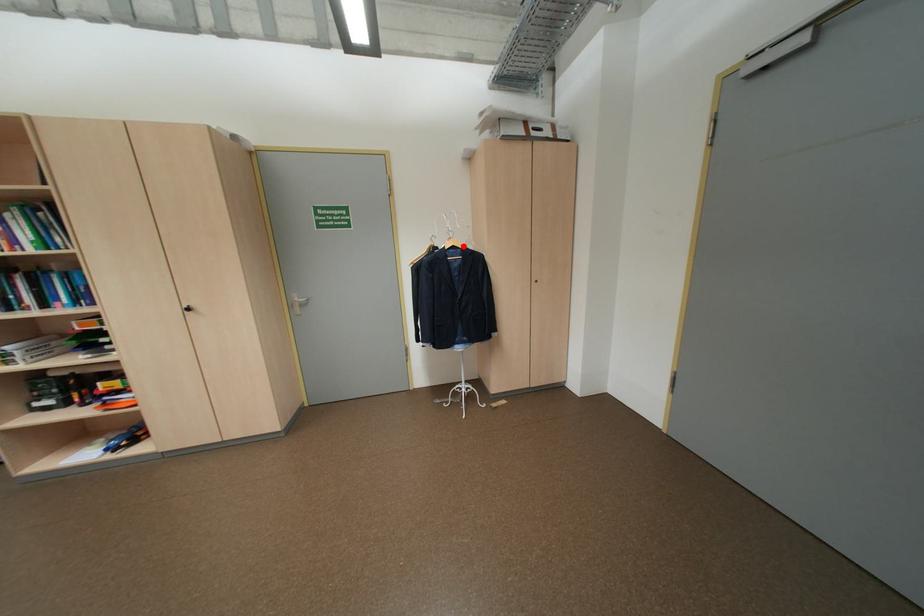
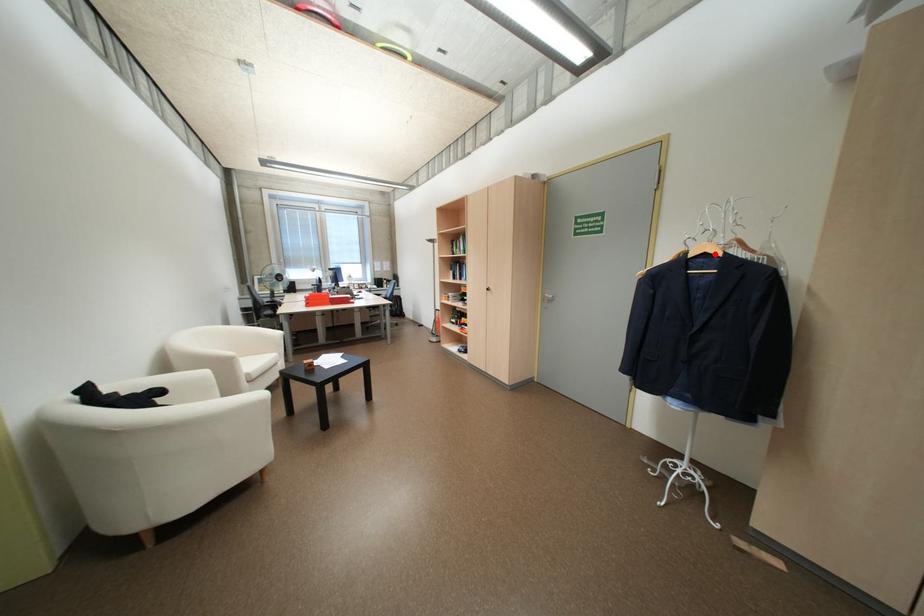
I am providing you with two images of the same scene from different viewpoints. A red point is marked on the first image and another point is marked on the second image. Do the highlighted points in image1 and image2 indicate the same real-world spot?

Yes